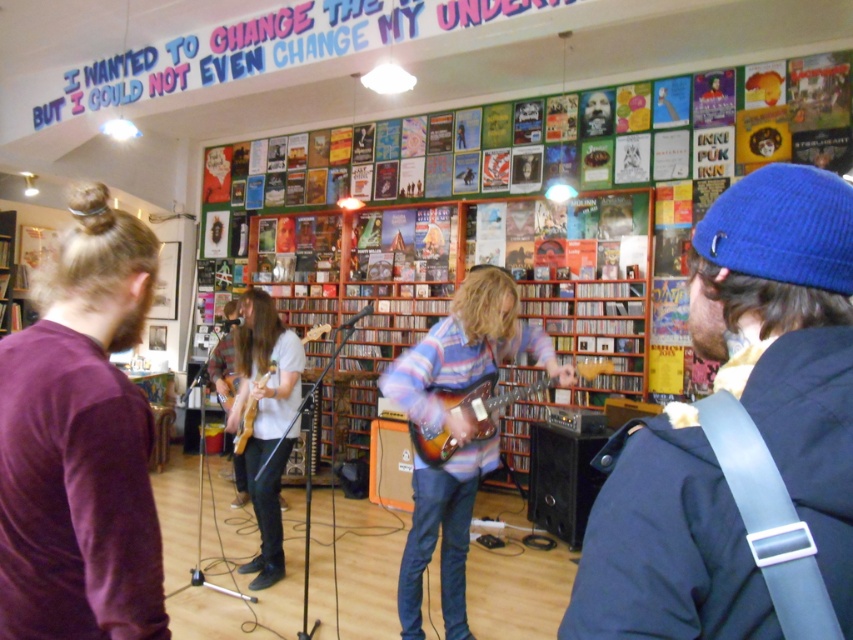
Question: Among these objects, which one is nearest to the camera?

Choices:
 (A) blue knit beanie at upper right
 (B) purple soft sweater at left

Answer: (A)

Question: Can you confirm if blue knit beanie at upper right is smaller than sunburst wood electric guitar at center?

Choices:
 (A) no
 (B) yes

Answer: (B)

Question: Which of the following is the farthest from the observer?

Choices:
 (A) sunburst wood electric guitar at center
 (B) wooden acoustic guitar at center

Answer: (B)

Question: From the image, what is the correct spatial relationship of striped cotton shirt at center in relation to sunburst wood electric guitar at center?

Choices:
 (A) right
 (B) left

Answer: (B)

Question: Considering the relative positions of purple soft sweater at left and striped cotton shirt at center in the image provided, where is purple soft sweater at left located with respect to striped cotton shirt at center?

Choices:
 (A) left
 (B) right

Answer: (A)

Question: Which of these objects is positioned farthest from the sunburst wood electric guitar at center?

Choices:
 (A) white matte shirt at center
 (B) striped cotton shirt at center
 (C) blue knit beanie at upper right

Answer: (C)